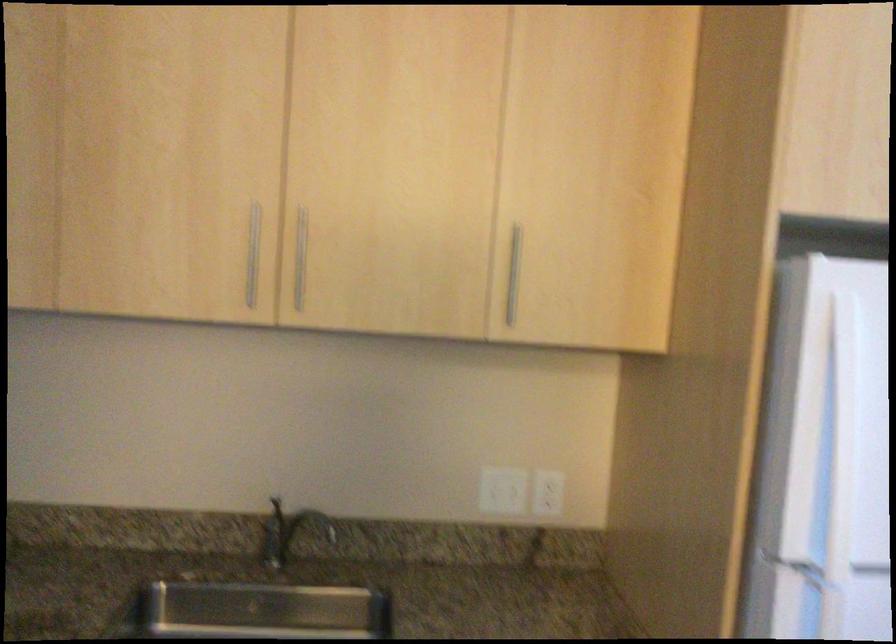
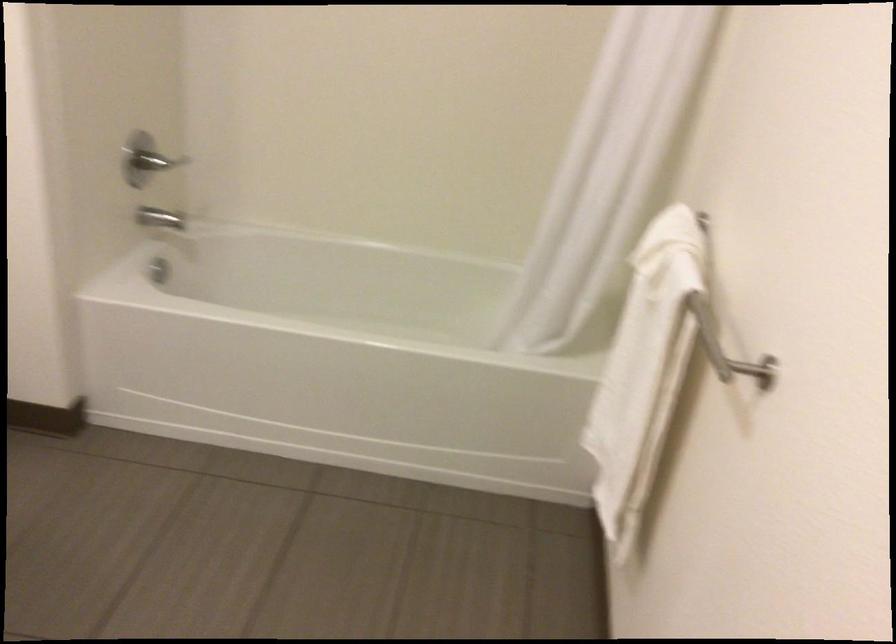
How did the camera likely rotate?

The camera's rotation is toward left-down.